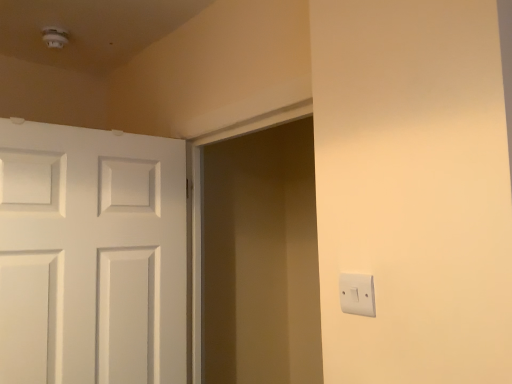
Question: Based on their sizes in the image, would you say white plastic light switch at right is bigger or smaller than matte white screen door at center?

Choices:
 (A) big
 (B) small

Answer: (B)

Question: From a real-world perspective, is white plastic light switch at right physically located above or below matte white screen door at center?

Choices:
 (A) above
 (B) below

Answer: (B)

Question: Based on their relative distances, which object is farther from the matte white screen door at center?

Choices:
 (A) white plastic light switch at right
 (B) white painted wood door at left

Answer: (A)

Question: Which of these objects is positioned farthest from the white plastic light switch at right?

Choices:
 (A) matte white screen door at center
 (B) white painted wood door at left

Answer: (A)